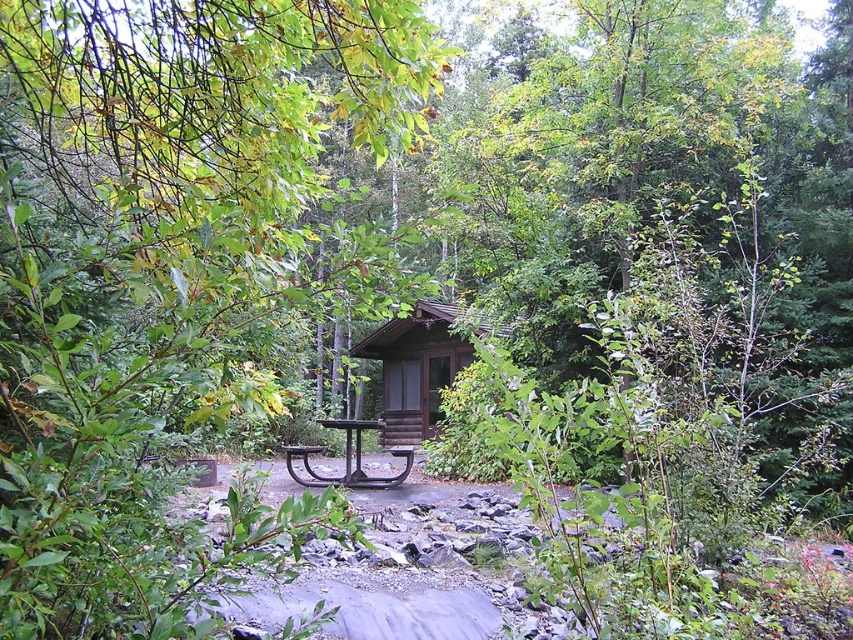
Question: Which point is farther to the camera?

Choices:
 (A) black wrought iron picnic table at center
 (B) brown wooden hut at center
 (C) green leafy tree at center

Answer: (B)

Question: Which object appears farthest from the camera in this image?

Choices:
 (A) green leafy tree at center
 (B) black wrought iron picnic table at center

Answer: (B)

Question: Is green leafy tree at center to the right of brown wooden hut at center from the viewer's perspective?

Choices:
 (A) yes
 (B) no

Answer: (B)

Question: From the image, what is the correct spatial relationship of green leafy tree at center in relation to brown wooden hut at center?

Choices:
 (A) below
 (B) above

Answer: (B)

Question: Is brown wooden hut at center closer to camera compared to black wrought iron picnic table at center?

Choices:
 (A) yes
 (B) no

Answer: (B)

Question: Which of the following is the farthest from the observer?

Choices:
 (A) black wrought iron picnic table at center
 (B) brown wooden hut at center

Answer: (B)